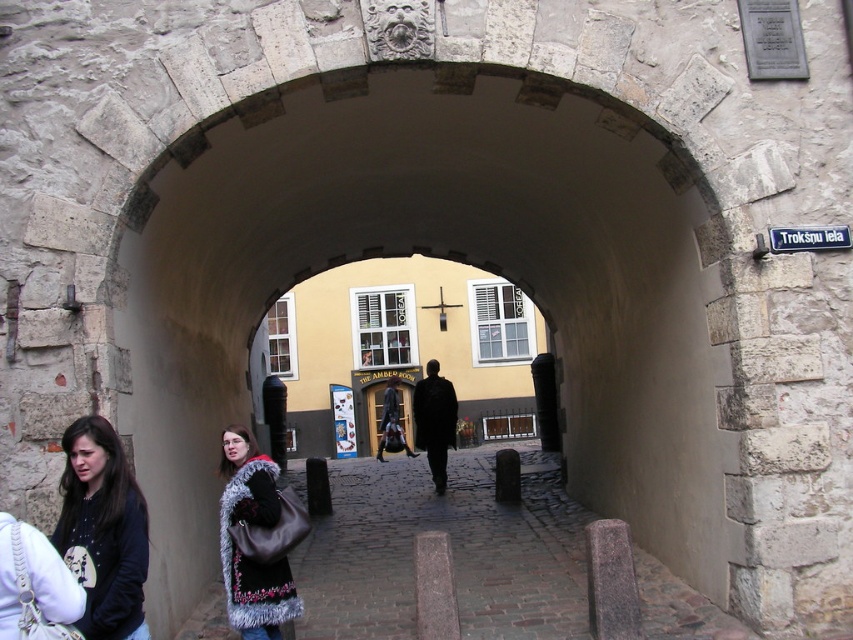
You are standing in front of the stone archway and notice a point marked at coordinates (x=103, y=531). Based on the scene description, what object or feature does this point most likely correspond to?

The point at coordinates (x=103, y=531) corresponds to the dark brown hair at left, as stated in the Objects Description.